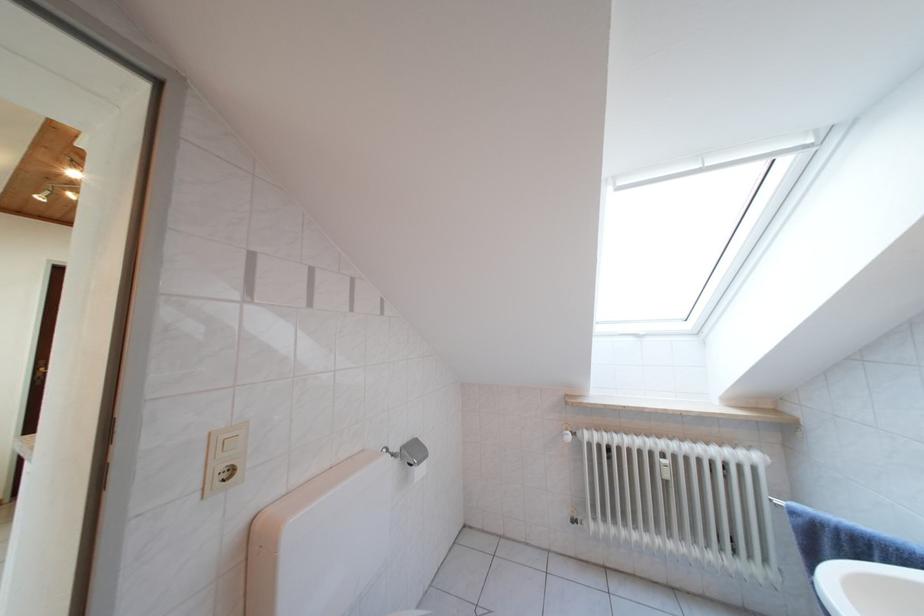
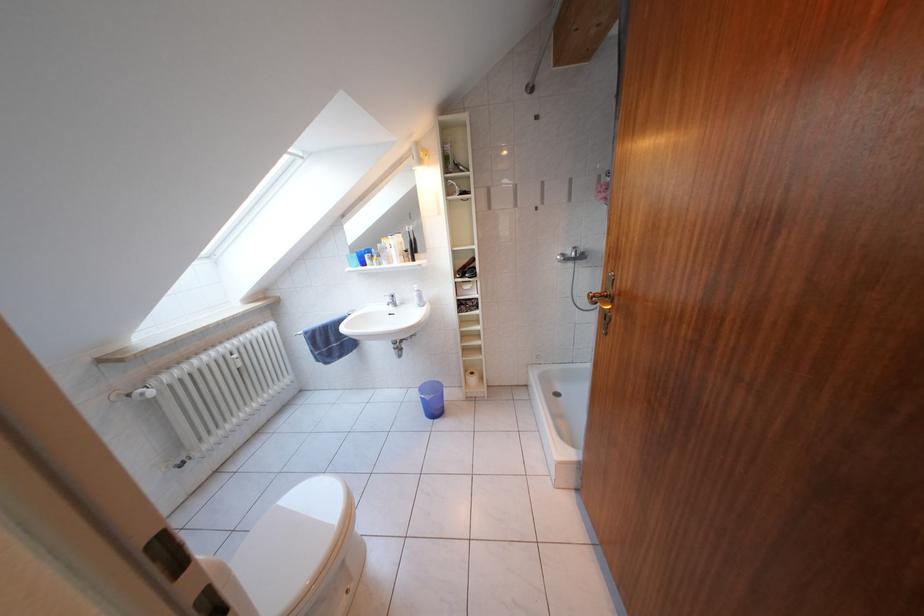
How did the camera likely rotate?

The rotation direction of the camera is right-down.